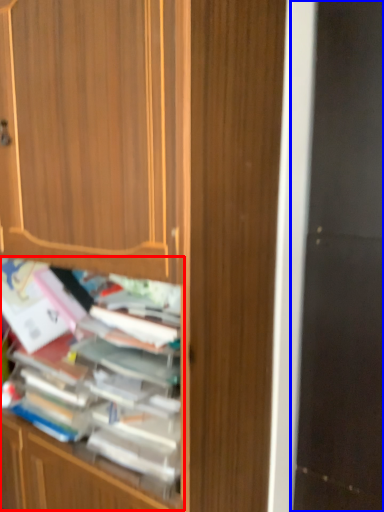
Question: Among these objects, which one is nearest to the camera, shelf (highlighted by a red box) or screen door (highlighted by a blue box)?

Choices:
 (A) shelf
 (B) screen door

Answer: (A)